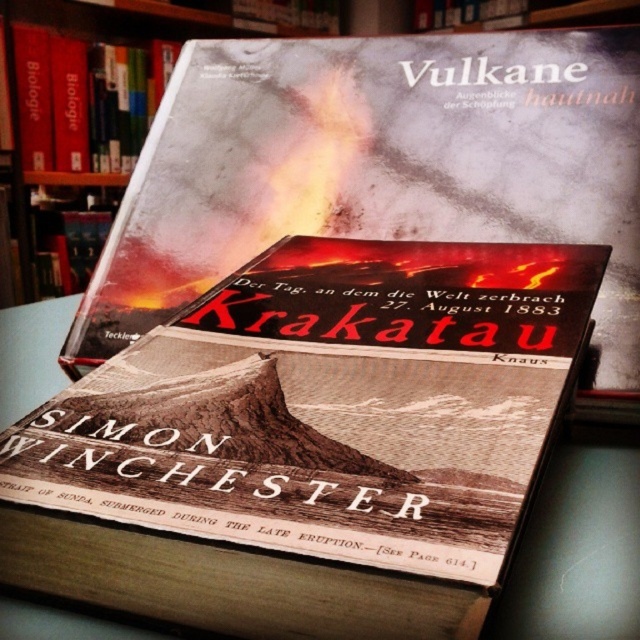
Who is higher up, sepia-toned paper at center or hardcover book at upper center?

hardcover book at upper center is higher up.

Does sepia-toned paper at center have a larger size compared to hardcover book at upper center?

Yes.

Is point (157, 550) positioned after point (122, 54)?

No.

Locate an element on the screen. This screenshot has height=640, width=640. sepia-toned paper at center is located at coordinates (332, 404).

Does matte paper book at center have a lesser width compared to hardcover book at upper center?

No.

Where is `matte paper book at center`? matte paper book at center is located at coordinates (380, 168).

Identify the location of matte paper book at center. coord(380,168).

Is point (397, 621) farther from camera compared to point (560, 177)?

No, (397, 621) is in front of (560, 177).

Where is `sepia-toned paper at center`? This screenshot has width=640, height=640. sepia-toned paper at center is located at coordinates (332, 404).